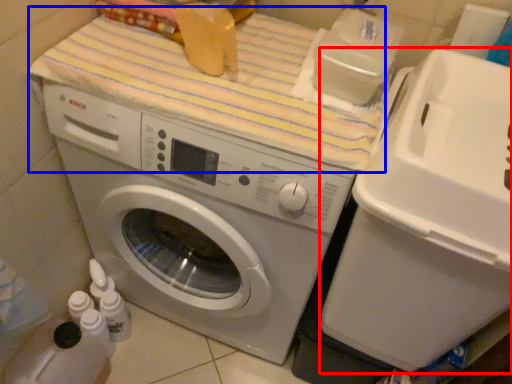
Question: Which object appears closest to the camera in this image, water cooler (highlighted by a red box) or bath towel (highlighted by a blue box)?

Choices:
 (A) water cooler
 (B) bath towel

Answer: (A)